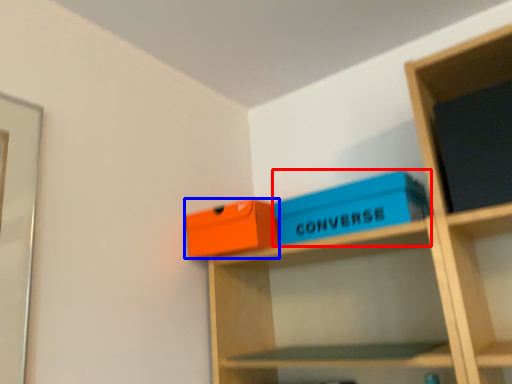
Question: Which point is further to the camera, box (highlighted by a red box) or box (highlighted by a blue box)?

Choices:
 (A) box
 (B) box

Answer: (B)